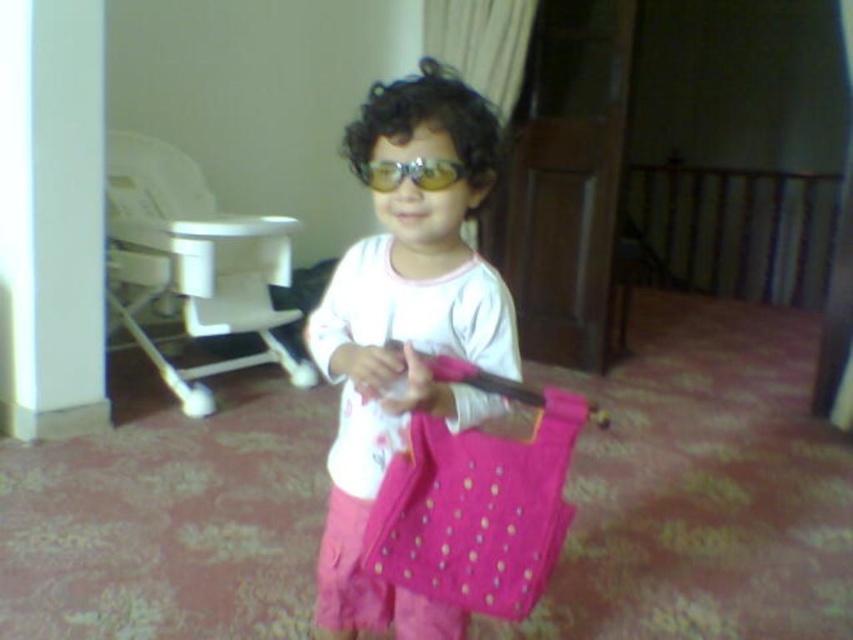
Question: Can you confirm if matte pink fabric at center is bigger than yellow reflective lenses at center?

Choices:
 (A) yes
 (B) no

Answer: (A)

Question: Can you confirm if matte pink fabric at center is positioned to the right of yellow reflective lenses at center?

Choices:
 (A) no
 (B) yes

Answer: (A)

Question: Which point is farther to the camera?

Choices:
 (A) (463, 176)
 (B) (401, 147)

Answer: (A)

Question: Can you confirm if matte pink fabric at center is positioned to the right of yellow reflective lenses at center?

Choices:
 (A) yes
 (B) no

Answer: (B)